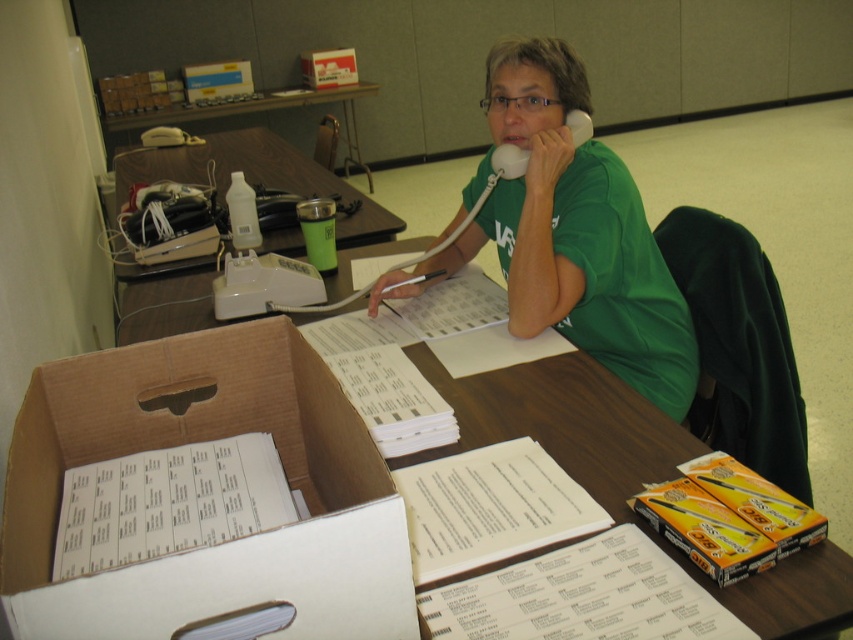
Question: Among these objects, which one is farthest from the camera?

Choices:
 (A) wooden table at upper center
 (B) blue cardboard box at upper left
 (C) white cardboard box at center
 (D) white cardboard box at upper center

Answer: (D)

Question: In this image, where is white plastic telephone at upper left located relative to blue cardboard box at upper left?

Choices:
 (A) above
 (B) below

Answer: (B)

Question: Does white cardboard box at center have a larger size compared to white plastic telephone at upper left?

Choices:
 (A) yes
 (B) no

Answer: (B)

Question: Considering the relative positions of white paper at center and white plastic telephone at upper left in the image provided, where is white paper at center located with respect to white plastic telephone at upper left?

Choices:
 (A) above
 (B) below

Answer: (B)

Question: Among these points, which one is farthest from the camera?

Choices:
 (A) (151, 163)
 (B) (309, 81)

Answer: (B)

Question: Which point is farther to the camera?

Choices:
 (A) blue cardboard box at upper left
 (B) white paper at center

Answer: (A)